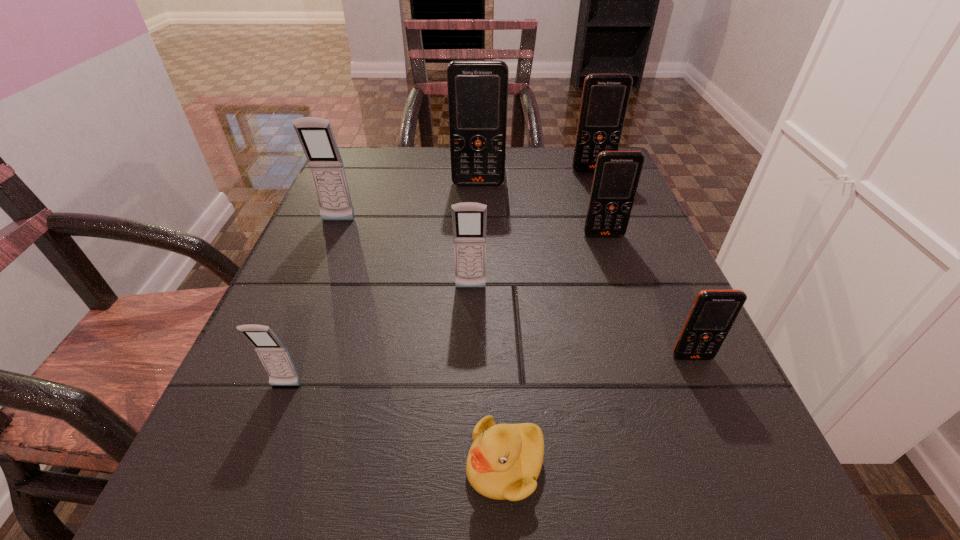
Image resolution: width=960 pixels, height=540 pixels. In order to click on free space located on the screen of the fourth farthest cellular telephone in this screenshot , I will do `click(611, 255)`.

Locate an element on the screen. The height and width of the screenshot is (540, 960). free space located on the screen of the third nearest object is located at coordinates (761, 515).

This screenshot has width=960, height=540. What are the coordinates of `vacant space located 0.120m on the front-facing side of the nearest cellular telephone` in the screenshot? It's located at (250, 479).

Locate an element on the screen. The image size is (960, 540). vacant space located 0.180m on the front-facing side of the nearest object is located at coordinates (317, 465).

You are a GUI agent. You are given a task and a screenshot of the screen. Output one action in this format:
    pyautogui.click(x=<x>, y=<y>)
    Task: Click on the vacant area located 0.090m on the front-facing side of the nearest object
    This screenshot has width=960, height=540.
    Given the screenshot: What is the action you would take?
    pyautogui.click(x=392, y=465)

The width and height of the screenshot is (960, 540). I want to click on vacant space situated 0.310m on the front-facing side of the nearest object, so [x=209, y=465].

At what (x,y) coordinates should I click in order to perform the action: click on object located at the near edge. Please return your answer as a coordinate pair (x, y). Looking at the image, I should click on (504, 461).

Identify the location of object that is at the far right corner. This screenshot has height=540, width=960. (605, 97).

Locate an element on the screen. Image resolution: width=960 pixels, height=540 pixels. vacant area at the far edge of the desktop is located at coordinates (527, 154).

In order to click on free space at the left edge of the desktop in this screenshot , I will do `click(325, 328)`.